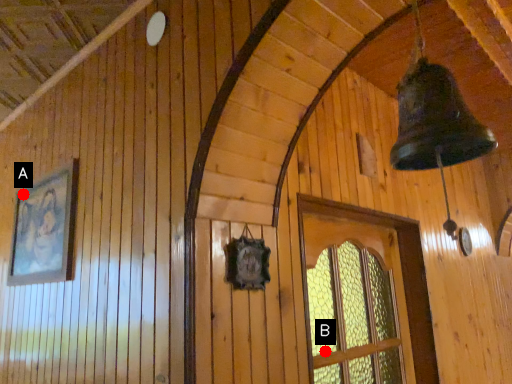
Question: Two points are circled on the image, labeled by A and B beside each circle. Which point is farther to the camera?

Choices:
 (A) A is further
 (B) B is further

Answer: (A)